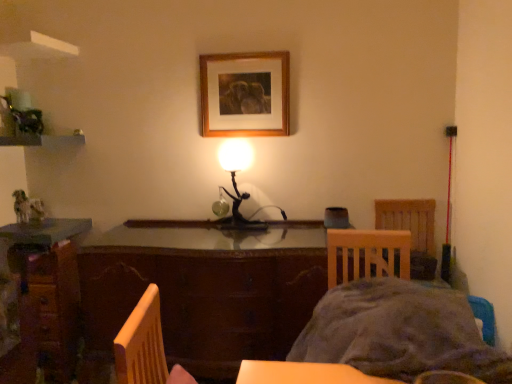
Question: Does gray fabric bed at lower right have a smaller size compared to wooden desk at lower left?

Choices:
 (A) yes
 (B) no

Answer: (B)

Question: Could you tell me if gray fabric bed at lower right is facing wooden desk at lower left?

Choices:
 (A) no
 (B) yes

Answer: (A)

Question: Is gray fabric bed at lower right located outside wooden desk at lower left?

Choices:
 (A) yes
 (B) no

Answer: (A)

Question: Is gray fabric bed at lower right not close to wooden desk at lower left?

Choices:
 (A) no
 (B) yes

Answer: (B)

Question: Is gray fabric bed at lower right positioned with its back to wooden desk at lower left?

Choices:
 (A) yes
 (B) no

Answer: (B)

Question: Is gray fabric bed at lower right bigger than wooden desk at lower left?

Choices:
 (A) no
 (B) yes

Answer: (B)

Question: Considering the relative sizes of wooden desk at lower left and gray fabric bed at lower right in the image provided, is wooden desk at lower left shorter than gray fabric bed at lower right?

Choices:
 (A) yes
 (B) no

Answer: (B)

Question: Is wooden desk at lower left smaller than gray fabric bed at lower right?

Choices:
 (A) yes
 (B) no

Answer: (A)

Question: From a real-world perspective, is wooden desk at lower left under gray fabric bed at lower right?

Choices:
 (A) yes
 (B) no

Answer: (A)

Question: From a real-world perspective, is wooden desk at lower left physically above gray fabric bed at lower right?

Choices:
 (A) yes
 (B) no

Answer: (B)

Question: From the image's perspective, is wooden desk at lower left over gray fabric bed at lower right?

Choices:
 (A) yes
 (B) no

Answer: (B)

Question: Is wooden desk at lower left placed right next to gray fabric bed at lower right?

Choices:
 (A) yes
 (B) no

Answer: (B)

Question: From a real-world perspective, is wooden chair at right on gray fabric bed at lower right?

Choices:
 (A) yes
 (B) no

Answer: (A)